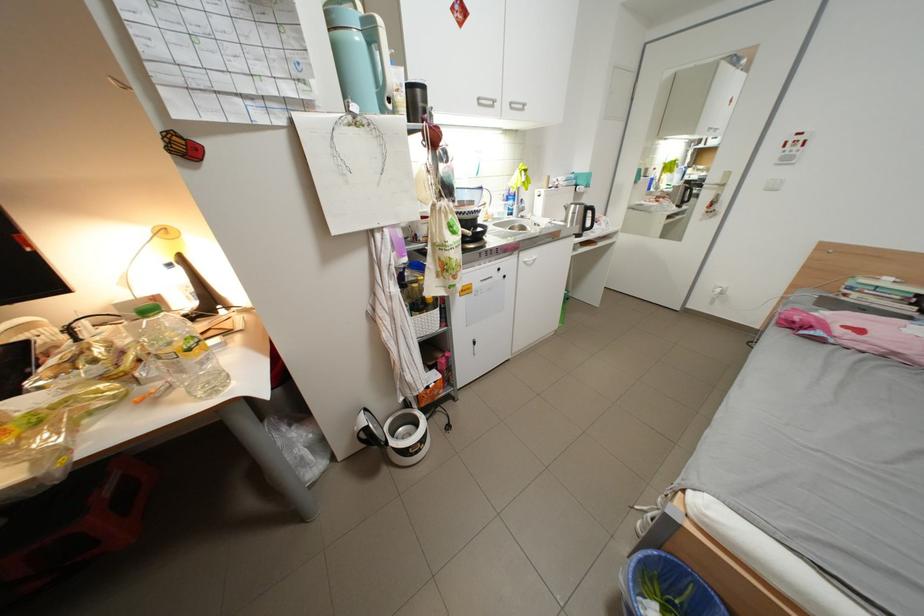
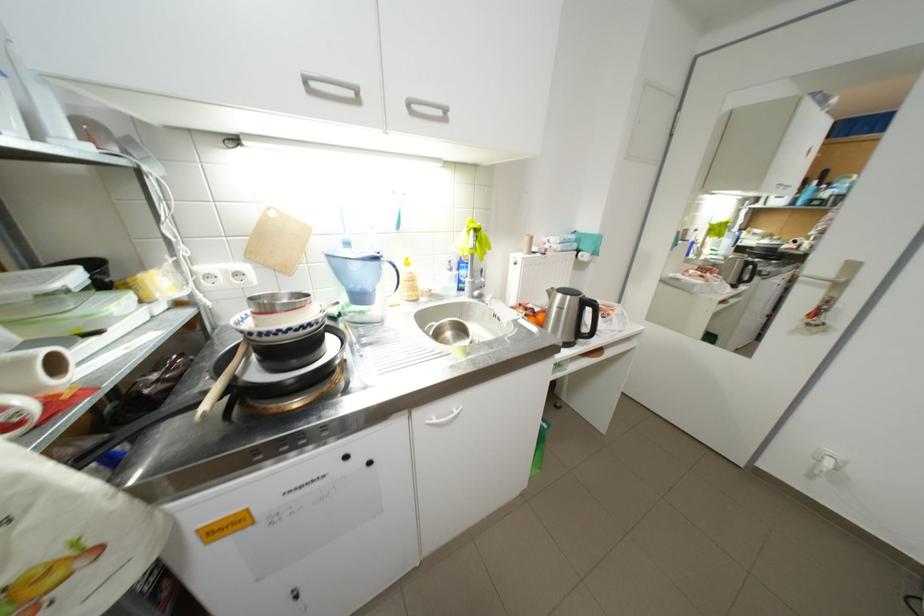
The point at (492, 188) is marked in the first image. Where is the corresponding point in the second image?

(387, 259)